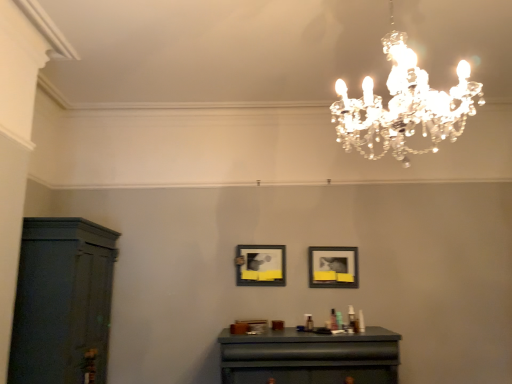
Question: Considering the relative sizes of matte black picture frame at center, the 2th picture frame in the right-to-left sequence, and matte black table at center in the image provided, is matte black picture frame at center, the 2th picture frame in the right-to-left sequence, shorter than matte black table at center?

Choices:
 (A) yes
 (B) no

Answer: (A)

Question: From a real-world perspective, is matte black picture frame at center, the 2th picture frame in the right-to-left sequence, on top of matte black table at center?

Choices:
 (A) no
 (B) yes

Answer: (B)

Question: Does matte black picture frame at center, the 2th picture frame in the right-to-left sequence, contain matte black table at center?

Choices:
 (A) no
 (B) yes

Answer: (A)

Question: Does matte black picture frame at center, placed as the first picture frame when sorted from left to right, have a larger size compared to matte black table at center?

Choices:
 (A) no
 (B) yes

Answer: (A)

Question: Is matte black picture frame at center, placed as the first picture frame when sorted from left to right, not near matte black table at center?

Choices:
 (A) no
 (B) yes

Answer: (A)

Question: Does matte black picture frame at center, placed as the first picture frame when sorted from left to right, turn towards matte black table at center?

Choices:
 (A) yes
 (B) no

Answer: (B)

Question: Would you say dark wood cabinet at left is outside clear crystal chandelier at upper center?

Choices:
 (A) yes
 (B) no

Answer: (A)

Question: From the image's perspective, does dark wood cabinet at left appear lower than clear crystal chandelier at upper center?

Choices:
 (A) yes
 (B) no

Answer: (A)

Question: Are dark wood cabinet at left and clear crystal chandelier at upper center making contact?

Choices:
 (A) yes
 (B) no

Answer: (B)

Question: Considering the relative sizes of dark wood cabinet at left and clear crystal chandelier at upper center in the image provided, is dark wood cabinet at left taller than clear crystal chandelier at upper center?

Choices:
 (A) yes
 (B) no

Answer: (A)

Question: From a real-world perspective, is dark wood cabinet at left physically below clear crystal chandelier at upper center?

Choices:
 (A) yes
 (B) no

Answer: (A)

Question: Is dark wood cabinet at left further to camera compared to clear crystal chandelier at upper center?

Choices:
 (A) yes
 (B) no

Answer: (A)

Question: Would you say dark wood cabinet at left is part of clear crystal chandelier at upper center's contents?

Choices:
 (A) no
 (B) yes

Answer: (A)